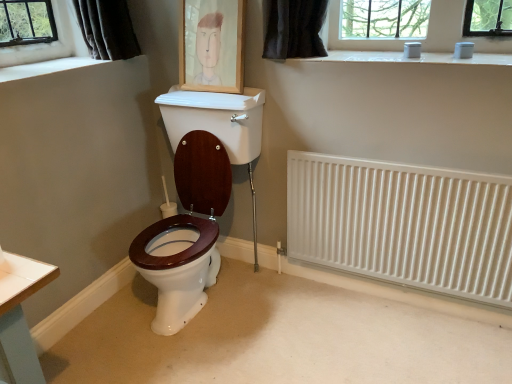
Question: Is point (500, 301) closer or farther from the camera than point (212, 19)?

Choices:
 (A) closer
 (B) farther

Answer: (A)

Question: Which is correct: white metallic radiator at right is inside wooden picture frame at upper center, or outside of it?

Choices:
 (A) outside
 (B) inside

Answer: (A)

Question: Estimate the real-world distances between objects in this image. Which object is closer to the white metallic radiator at right?

Choices:
 (A) wooden picture frame at upper center
 (B) white smooth window sill at upper left

Answer: (A)

Question: Estimate the real-world distances between objects in this image. Which object is farther from the wooden picture frame at upper center?

Choices:
 (A) white metallic radiator at right
 (B) white smooth window sill at upper left

Answer: (A)